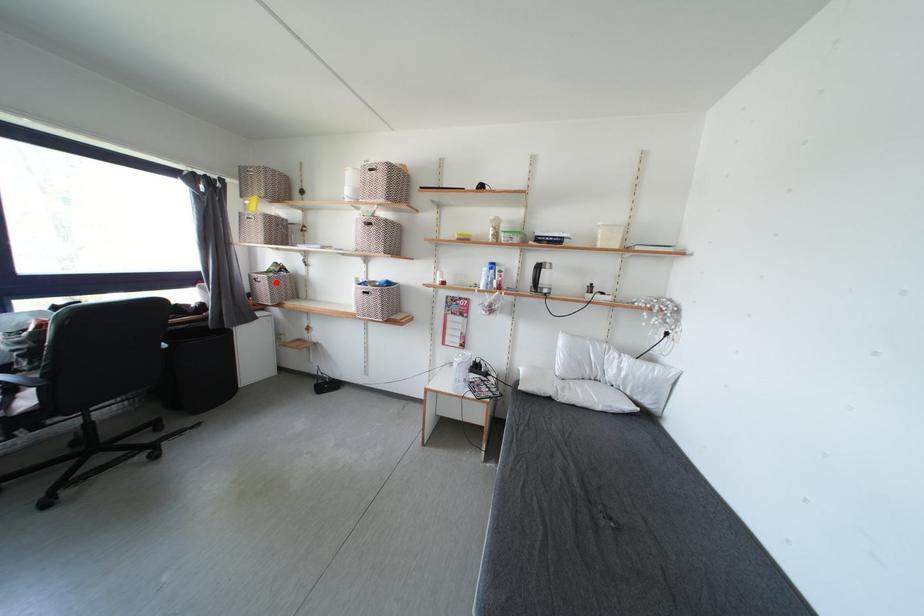
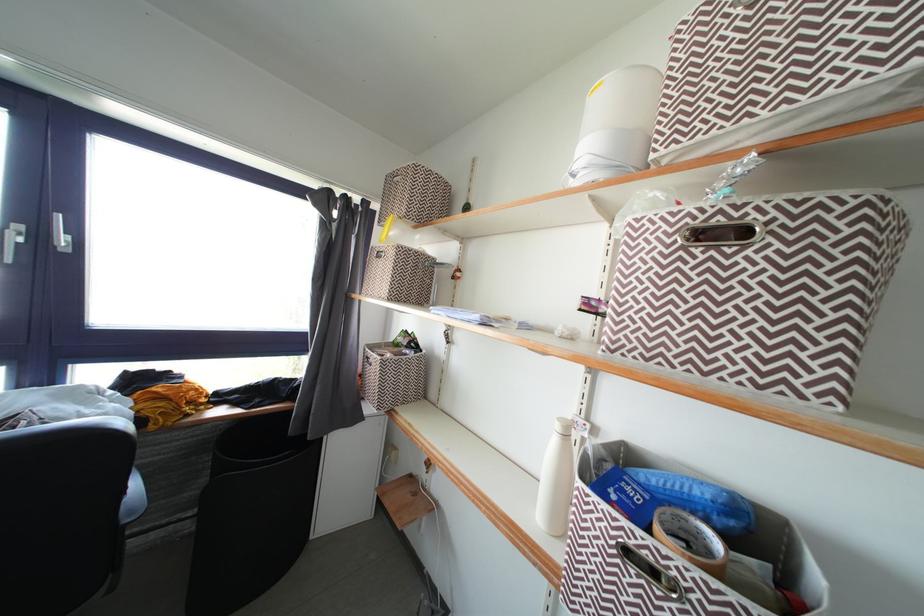
Question: I am providing you with two images of the same scene from different viewpoints. A red point is marked on the first image. At the location where the point appears in image 1, is it still visible in image 2?

Choices:
 (A) Yes
 (B) No

Answer: (A)